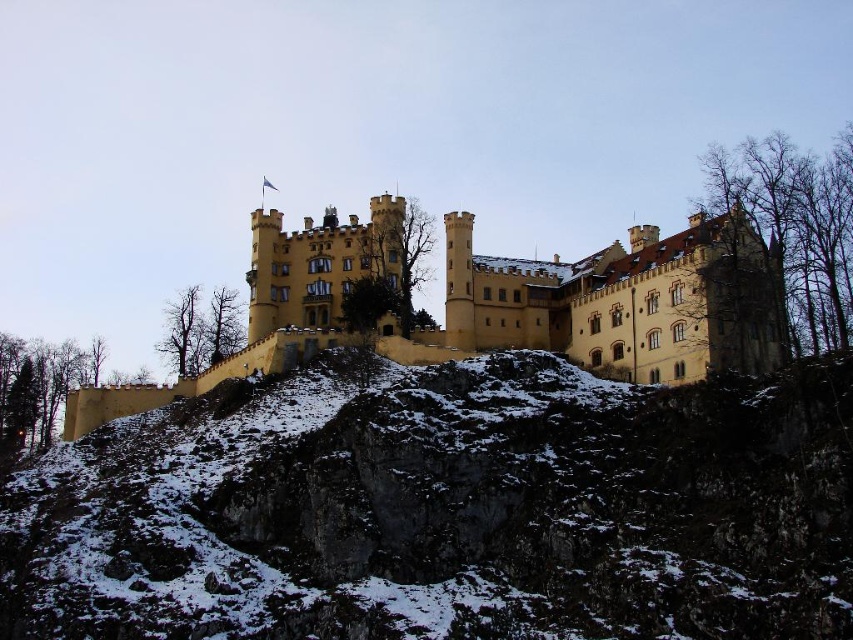
You are an architect examining the castle structure. You notice the yellow stone wall at center and the yellow stone castle at center. Which one has a smaller width?

The yellow stone wall at center is thinner than the yellow stone castle at center, so the yellow stone wall at center has a smaller width.

You are an architect inspecting the castle layout. You notice two structures labeled as yellow stone wall at center and yellow stone castle at center. Which one is located to the right of the other?

The yellow stone wall at center is positioned on the right side of yellow stone castle at center, meaning the wall is to the right of the castle.

You are a tourist visiting the castle and want to take a photo of both the yellow stone wall at center and the yellow stone castle at center. Since you want to include both in the frame, which one should you focus on to ensure both are visible?

You should focus on the yellow stone castle at center because it is taller than the yellow stone wall at center, so positioning the camera to capture its height will naturally include the shorter wall in the frame.